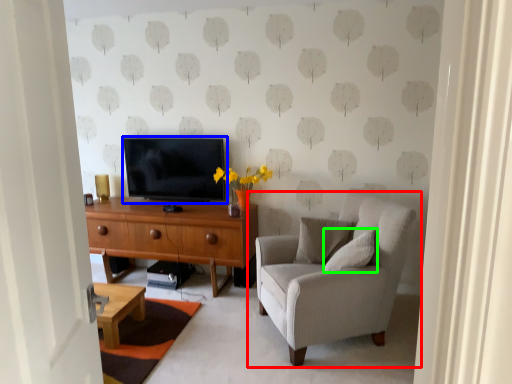
Question: Considering the real-world distances, which object is farthest from chair (highlighted by a red box)? television (highlighted by a blue box) or pillow (highlighted by a green box)?

Choices:
 (A) television
 (B) pillow

Answer: (A)